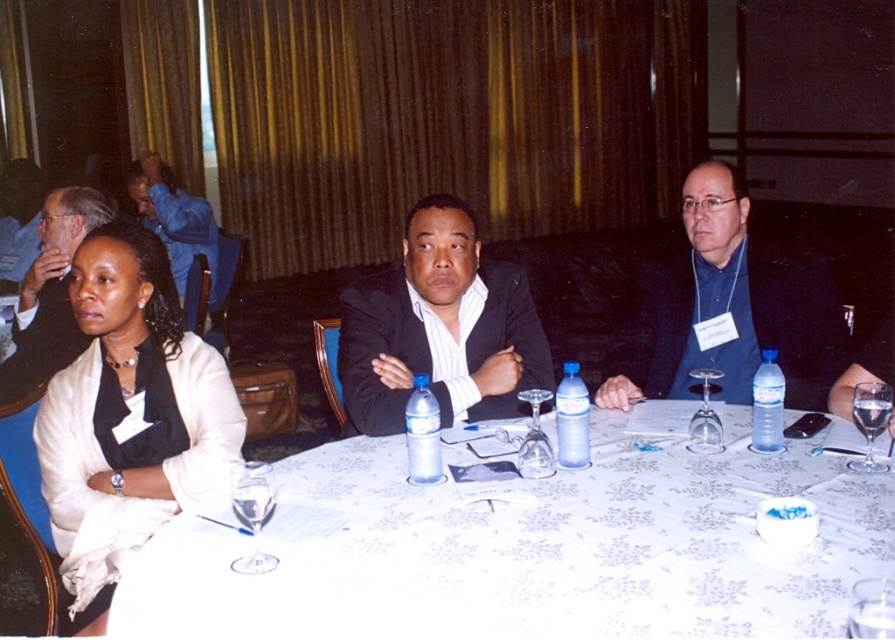
Does white satin blouse at lower left come behind black matte suit at center?

No, white satin blouse at lower left is closer to the viewer.

Does white satin blouse at lower left lie in front of black matte suit at center?

Yes, it is.

Who is more forward, (151, 396) or (382, 298)?

Point (151, 396)

Locate an element on the screen. The image size is (895, 640). white satin blouse at lower left is located at coordinates (128, 413).

Who is taller, blue cotton shirt at upper left or clear plastic bottle at table center?

blue cotton shirt at upper left is taller.

Is blue cotton shirt at upper left to the left of clear plastic bottle at table center from the viewer's perspective?

Indeed, blue cotton shirt at upper left is positioned on the left side of clear plastic bottle at table center.

Measure the distance between blue cotton shirt at upper left and camera.

blue cotton shirt at upper left is 3.78 meters from camera.

The image size is (895, 640). I want to click on blue cotton shirt at upper left, so click(x=175, y=218).

Is white floral tablecloth at lower center thinner than clear plastic bottle at center?

No, white floral tablecloth at lower center is not thinner than clear plastic bottle at center.

Between point (621, 467) and point (418, 410), which one is positioned behind?

The point (621, 467) is behind.

Locate an element on the screen. This screenshot has width=895, height=640. white floral tablecloth at lower center is located at coordinates coord(530,552).